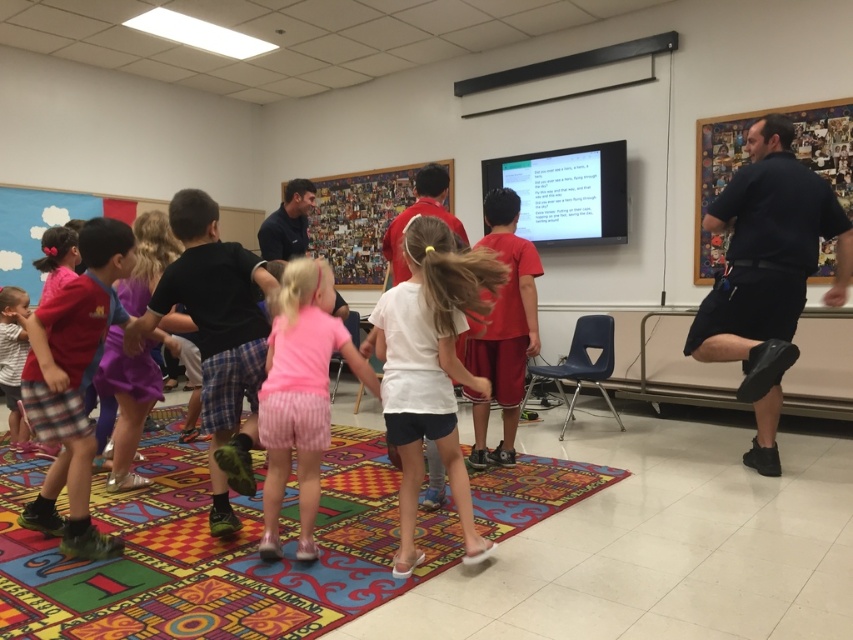
Based on the photo, you are a photographer trying to capture a photo of the white matte shirt at center and the purple fabric skirt at center. Which one should you focus on first if you want to ensure both are in focus?

The white matte shirt at center is positioned under the purple fabric skirt at center, so focusing on the purple fabric skirt at center first would ensure both are in focus since it is closer to the camera.

In the scene, you see a white matte shirt at center and a purple fabric skirt at center. Which one is located to the right?

The white matte shirt at center is positioned on the right side of the purple fabric skirt at center, so the white matte shirt at center is located to the right.